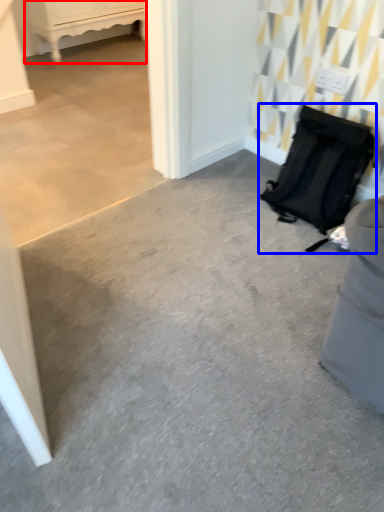
Question: Which of the following is the closest to the observer, furniture (highlighted by a red box) or luggage and bags (highlighted by a blue box)?

Choices:
 (A) furniture
 (B) luggage and bags

Answer: (B)